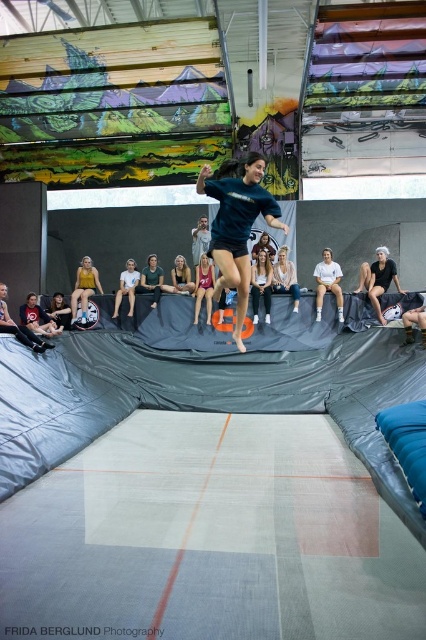
You are a safety inspector checking the trampoline park. You need to ensure that the distance between the matte blue shirt at center and the matte black helmet at left is at least 3 meters to comply with safety regulations. Is the current distance compliant?

The distance between the matte blue shirt at center and the matte black helmet at left is 4.19 meters, which exceeds the required 3 meters, so it is compliant with safety regulations.

You are a photographer trying to capture the perfect shot of the matte blue shirt at center and the matte black helmet at left. Since you want both objects to appear the same size in the photo, which object should you move closer to the camera?

The matte black helmet at left should be moved closer to the camera because the matte blue shirt at center is currently larger, so bringing the smaller matte black helmet at left nearer would balance their sizes in the photo.

You are a photographer positioned to capture the action at the trampoline park. You need to ensure that both the light brown hair at center and the matte black shorts at center are clearly visible in your shot. Based on their size in the image, which object should you focus on to ensure both are in frame?

You should focus on the matte black shorts at center because it occupies more space than the light brown hair at center, ensuring both will be visible in the frame.